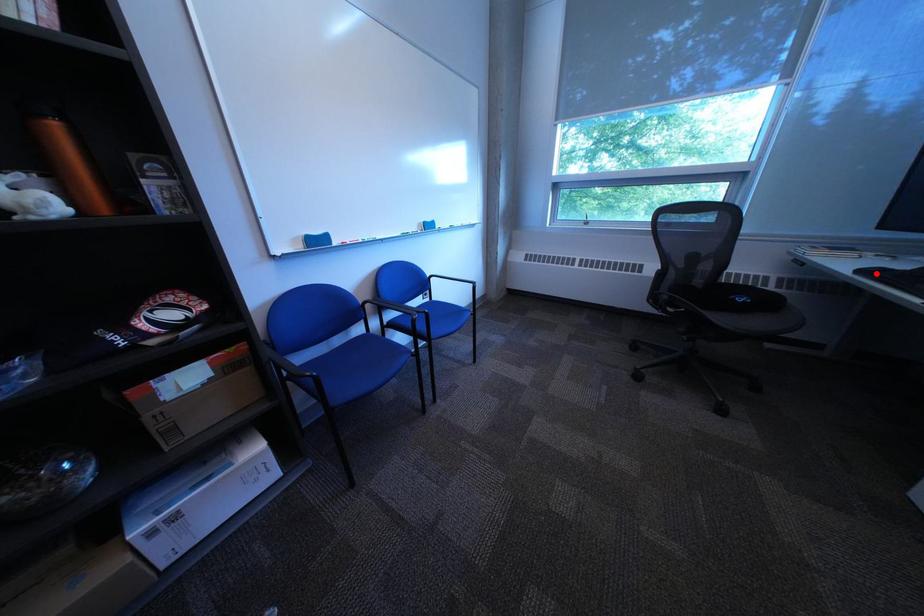
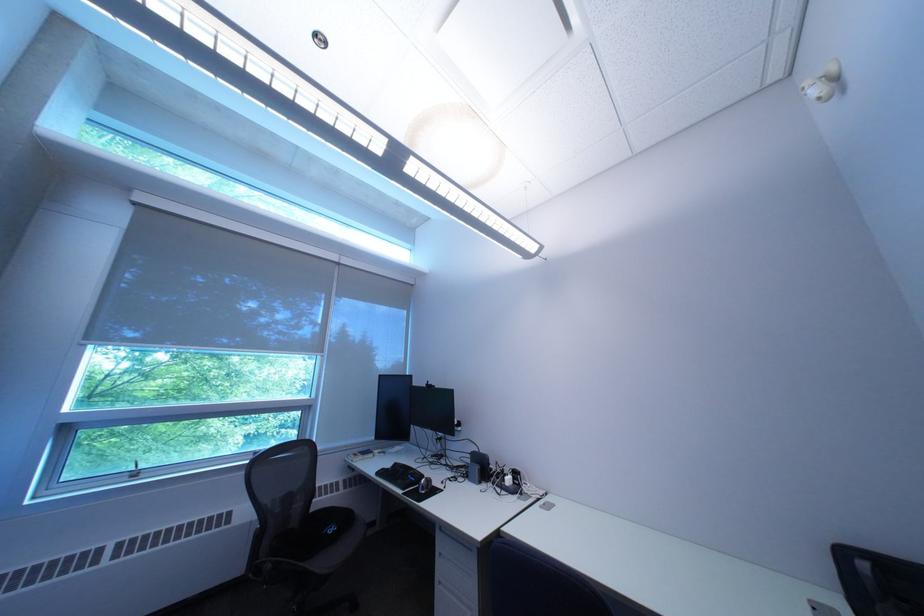
Find the pixel in the second image that matches the highlighted location in the first image.

(393, 475)